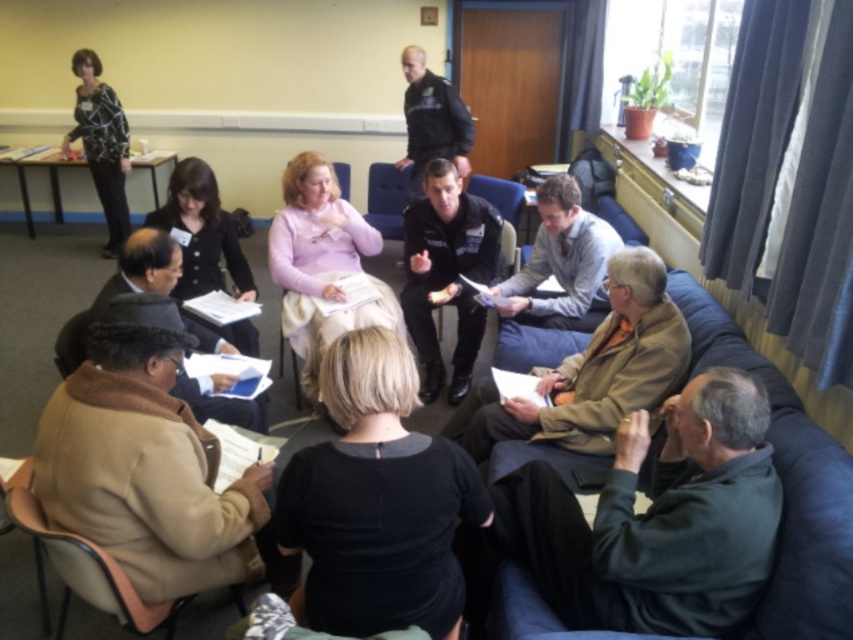
You are a person with a height of 5 feet. You are standing in the room and looking at the dark gray sweater at lower right. Can you see the top of the sweater without moving your head?

The dark gray sweater at lower right is 5.09 feet away from the viewer. Since the sweater is positioned at lower right, its top would be within the line of sight of a person who is 5 feet tall. Therefore, yes, you can see the top of the sweater without moving your head.

You are a guest entering the room and want to find the shortest object between the brown fuzzy coat at lower left and the dark blue uniform at upper center to place your bag. Which object should you choose?

The brown fuzzy coat at lower left is shorter than the dark blue uniform at upper center, so you should place your bag on the brown fuzzy coat at lower left.